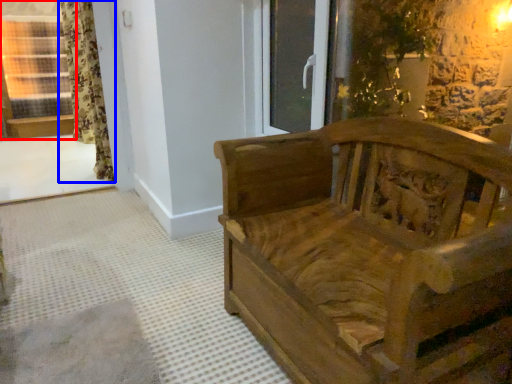
Question: Which of the following is the closest to the observer, window (highlighted by a red box) or curtain (highlighted by a blue box)?

Choices:
 (A) window
 (B) curtain

Answer: (A)